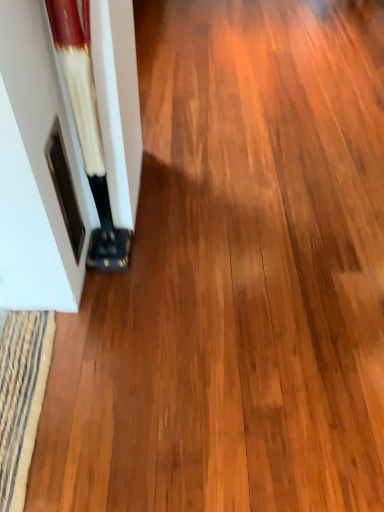
Locate an element on the screen. vacant space to the right of white glossy door at left is located at coordinates (152, 257).